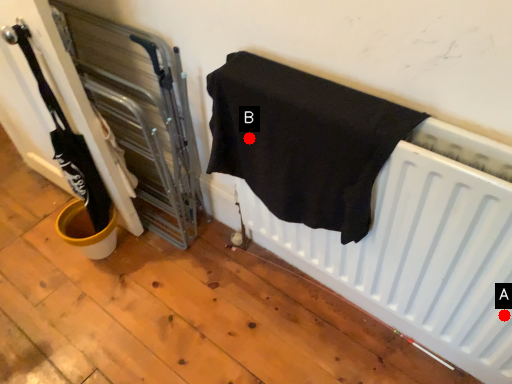
Question: Two points are circled on the image, labeled by A and B beside each circle. Among these points, which one is farthest from the camera?

Choices:
 (A) A is further
 (B) B is further

Answer: (B)